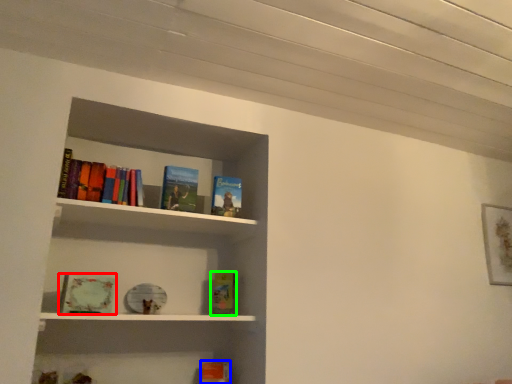
Question: Which object is the closest to the book (highlighted by a red box)? Choose among these: book (highlighted by a blue box) or book (highlighted by a green box).

Choices:
 (A) book
 (B) book

Answer: (B)